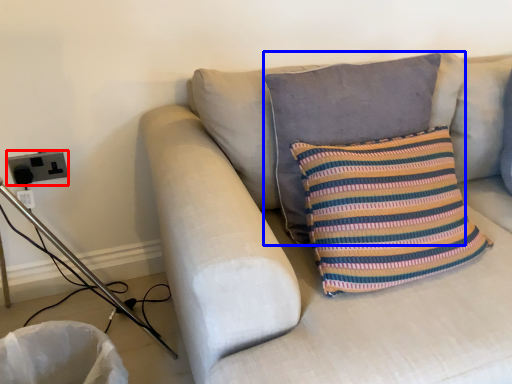
Question: Which point is closer to the camera, electric outlet (highlighted by a red box) or pillow (highlighted by a blue box)?

Choices:
 (A) electric outlet
 (B) pillow

Answer: (B)